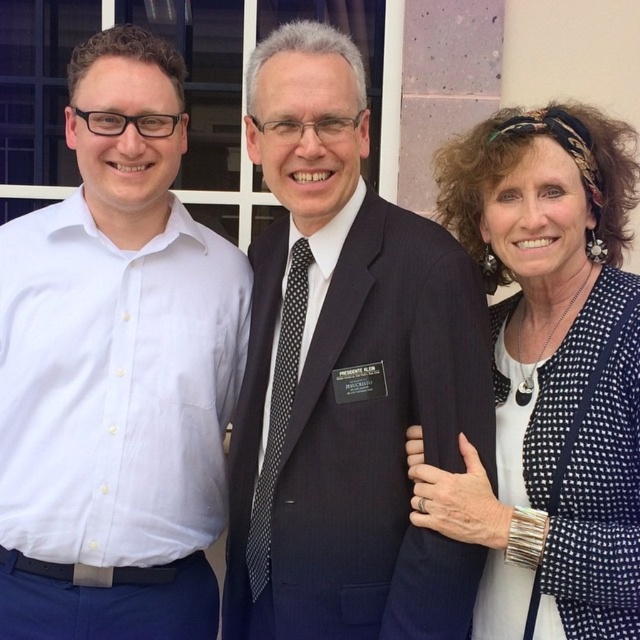
Based on the photo, how much distance is there between white cotton shirt at left and dark blue textured suit at center?

They are 17.74 inches apart.

Can you confirm if white cotton shirt at left is positioned to the right of dark blue textured suit at center?

Incorrect, white cotton shirt at left is not on the right side of dark blue textured suit at center.

Who is more distant from viewer, (132, 509) or (380, 490)?

The point (132, 509) is behind.

In order to click on white cotton shirt at left in this screenshot , I will do `click(116, 371)`.

Is dark blue textured suit at center shorter than white dotted cardigan at center?

Incorrect, dark blue textured suit at center's height does not fall short of white dotted cardigan at center's.

Looking at this image, does dark blue textured suit at center have a smaller size compared to white dotted cardigan at center?

Incorrect, dark blue textured suit at center is not smaller in size than white dotted cardigan at center.

Is point (250, 340) positioned after point (547, 452)?

Yes, it is.

The height and width of the screenshot is (640, 640). Identify the location of dark blue textured suit at center. (346, 376).

Can you confirm if white cotton shirt at left is thinner than white dotted cardigan at center?

Incorrect, white cotton shirt at left's width is not less than white dotted cardigan at center's.

Between point (157, 205) and point (518, 124), which one is positioned in front?

Point (518, 124)

What do you see at coordinates (116, 371) in the screenshot? I see `white cotton shirt at left` at bounding box center [116, 371].

The width and height of the screenshot is (640, 640). I want to click on white cotton shirt at left, so (x=116, y=371).